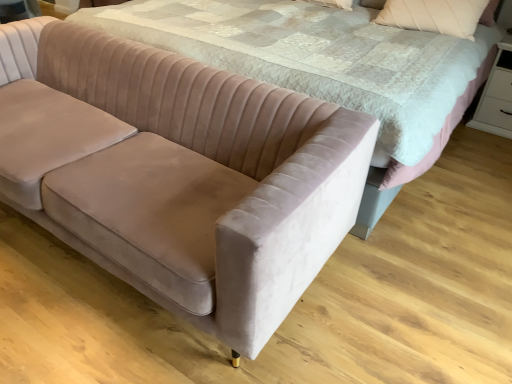
Where is `velvet pink bed at center`? velvet pink bed at center is located at coordinates (329, 68).

This screenshot has width=512, height=384. What do you see at coordinates (496, 97) in the screenshot?
I see `white glossy dresser at lower right` at bounding box center [496, 97].

Where is `velvet beige couch at lower left`? velvet beige couch at lower left is located at coordinates (178, 173).

From a real-world perspective, does velvet beige pillow at upper right stand above white glossy dresser at lower right?

Yes, from a real-world perspective, velvet beige pillow at upper right is above white glossy dresser at lower right.

Considering the positions of objects velvet beige pillow at upper right and white glossy dresser at lower right in the image provided, who is in front, velvet beige pillow at upper right or white glossy dresser at lower right?

Positioned in front is velvet beige pillow at upper right.

The width and height of the screenshot is (512, 384). Find the location of `pillow in front of the white glossy dresser at lower right`. pillow in front of the white glossy dresser at lower right is located at coordinates (434, 15).

From the picture: Is velvet beige pillow at upper right located outside velvet pink bed at center?

No.

At what (x,y) coordinates should I click in order to perform the action: click on pillow positioned vertically above the velvet pink bed at center (from a real-world perspective). Please return your answer as a coordinate pair (x, y). The height and width of the screenshot is (384, 512). Looking at the image, I should click on (434, 15).

Is velvet beige pillow at upper right in front of or behind velvet pink bed at center in the image?

Clearly, velvet beige pillow at upper right is behind velvet pink bed at center.

From the image's perspective, which object appears higher, velvet beige pillow at upper right or velvet pink bed at center?

velvet beige pillow at upper right is shown above in the image.

Is white glossy dresser at lower right wider or thinner than velvet beige pillow at upper right?

Clearly, white glossy dresser at lower right has more width compared to velvet beige pillow at upper right.

Can you tell me how much white glossy dresser at lower right and velvet beige pillow at upper right differ in facing direction?

The facing directions of white glossy dresser at lower right and velvet beige pillow at upper right are 1.76 degrees apart.

This screenshot has width=512, height=384. Identify the location of pillow above the white glossy dresser at lower right (from the image's perspective). point(434,15).

How different are the orientations of velvet beige couch at lower left and velvet beige pillow at upper right in degrees?

velvet beige couch at lower left and velvet beige pillow at upper right are facing 1.65 degrees away from each other.

Is velvet beige couch at lower left taller or shorter than velvet beige pillow at upper right?

In the image, velvet beige couch at lower left appears to be taller than velvet beige pillow at upper right.

From the picture: Could you tell me if velvet beige couch at lower left is turned towards velvet beige pillow at upper right?

No, velvet beige couch at lower left is not facing towards velvet beige pillow at upper right.

Considering the relative positions of velvet beige couch at lower left and velvet beige pillow at upper right in the image provided, is velvet beige couch at lower left to the left of velvet beige pillow at upper right from the viewer's perspective?

Indeed, velvet beige couch at lower left is positioned on the left side of velvet beige pillow at upper right.

From the image's perspective, which is below, velvet pink bed at center or velvet beige pillow at upper right?

From the image's view, velvet pink bed at center is below.

In the scene shown: In terms of size, does velvet pink bed at center appear bigger or smaller than velvet beige pillow at upper right?

Clearly, velvet pink bed at center is larger in size than velvet beige pillow at upper right.

Measure the distance between velvet pink bed at center and velvet beige pillow at upper right.

They are 60.60 centimeters apart.

In the scene shown: From a real-world perspective, is velvet pink bed at center located beneath velvet beige pillow at upper right?

Indeed, from a real-world perspective, velvet pink bed at center is positioned beneath velvet beige pillow at upper right.

Considering the relative sizes of white glossy dresser at lower right and velvet beige couch at lower left in the image provided, is white glossy dresser at lower right thinner than velvet beige couch at lower left?

Correct, the width of white glossy dresser at lower right is less than that of velvet beige couch at lower left.

Can you tell me how much white glossy dresser at lower right and velvet beige couch at lower left differ in facing direction?

They differ by 0.112 degrees in their facing directions.

From a real-world perspective, does white glossy dresser at lower right stand above velvet beige couch at lower left?

No, from a real-world perspective, white glossy dresser at lower right is not above velvet beige couch at lower left.

Is white glossy dresser at lower right bigger than velvet beige couch at lower left?

Actually, white glossy dresser at lower right might be smaller than velvet beige couch at lower left.

Is white glossy dresser at lower right further to camera compared to velvet pink bed at center?

Yes, white glossy dresser at lower right is further from the camera.

Would you say white glossy dresser at lower right contains velvet pink bed at center?

No, velvet pink bed at center is located outside of white glossy dresser at lower right.

From a real-world perspective, is white glossy dresser at lower right physically above velvet pink bed at center?

No.

Where is `pillow lying in front of the white glossy dresser at lower right`? pillow lying in front of the white glossy dresser at lower right is located at coordinates (434, 15).

This screenshot has width=512, height=384. I want to click on pillow above the velvet pink bed at center (from a real-world perspective), so click(x=434, y=15).

Considering their positions, is velvet beige pillow at upper right positioned closer to white glossy dresser at lower right than velvet beige couch at lower left?

The object closer to white glossy dresser at lower right is velvet beige pillow at upper right.

Looking at the image, which one is located further to white glossy dresser at lower right, velvet beige couch at lower left or velvet pink bed at center?

velvet beige couch at lower left is positioned further to the anchor white glossy dresser at lower right.

Which object lies nearer to the anchor point velvet beige couch at lower left, velvet pink bed at center or velvet beige pillow at upper right?

velvet pink bed at center is positioned closer to the anchor velvet beige couch at lower left.

Estimate the real-world distances between objects in this image. Which object is closer to white glossy dresser at lower right, velvet beige pillow at upper right or velvet pink bed at center?

velvet beige pillow at upper right.

Based on their spatial positions, is white glossy dresser at lower right or velvet beige pillow at upper right closer to velvet beige couch at lower left?

velvet beige pillow at upper right.

Estimate the real-world distances between objects in this image. Which object is further from velvet pink bed at center, velvet beige pillow at upper right or white glossy dresser at lower right?

white glossy dresser at lower right.

Looking at the image, which one is located further to velvet pink bed at center, velvet beige couch at lower left or velvet beige pillow at upper right?

velvet beige couch at lower left is positioned further to the anchor velvet pink bed at center.

Which object lies nearer to the anchor point velvet beige pillow at upper right, velvet pink bed at center or white glossy dresser at lower right?

Based on the image, velvet pink bed at center appears to be nearer to velvet beige pillow at upper right.

Image resolution: width=512 pixels, height=384 pixels. I want to click on bed between velvet beige couch at lower left and velvet beige pillow at upper right, so click(329, 68).

You are a GUI agent. You are given a task and a screenshot of the screen. Output one action in this format:
    pyautogui.click(x=<x>, y=<y>)
    Task: Click on the pillow between velvet pink bed at center and white glossy dresser at lower right
    
    Given the screenshot: What is the action you would take?
    (434, 15)

Locate an element on the screen. pillow between velvet beige couch at lower left and white glossy dresser at lower right in the horizontal direction is located at coordinates (434, 15).

Locate an element on the screen. bed between velvet beige couch at lower left and white glossy dresser at lower right from left to right is located at coordinates (329, 68).